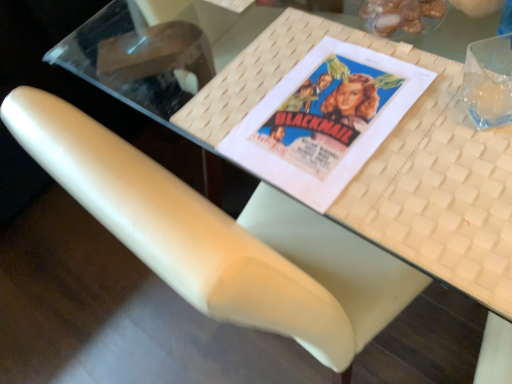
Question: Can you confirm if shiny brown nuts at upper right is smaller than white woven placemat at upper center?

Choices:
 (A) no
 (B) yes

Answer: (B)

Question: Does shiny brown nuts at upper right come in front of white woven placemat at upper center?

Choices:
 (A) yes
 (B) no

Answer: (B)

Question: Can you confirm if shiny brown nuts at upper right is bigger than white woven placemat at upper center?

Choices:
 (A) yes
 (B) no

Answer: (B)

Question: Can you confirm if shiny brown nuts at upper right is shorter than white woven placemat at upper center?

Choices:
 (A) yes
 (B) no

Answer: (B)

Question: Is shiny brown nuts at upper right facing away from white woven placemat at upper center?

Choices:
 (A) yes
 (B) no

Answer: (B)

Question: Considering the relative sizes of shiny brown nuts at upper right and white woven placemat at upper center in the image provided, is shiny brown nuts at upper right wider than white woven placemat at upper center?

Choices:
 (A) yes
 (B) no

Answer: (B)

Question: Is shiny brown nuts at upper right positioned far away from white leather chair at center?

Choices:
 (A) no
 (B) yes

Answer: (A)

Question: Considering the relative positions of shiny brown nuts at upper right and white leather chair at center in the image provided, is shiny brown nuts at upper right to the right of white leather chair at center from the viewer's perspective?

Choices:
 (A) no
 (B) yes

Answer: (B)

Question: Is shiny brown nuts at upper right smaller than white leather chair at center?

Choices:
 (A) yes
 (B) no

Answer: (A)

Question: From the image's perspective, is shiny brown nuts at upper right above white leather chair at center?

Choices:
 (A) yes
 (B) no

Answer: (A)

Question: Is white leather chair at center located within shiny brown nuts at upper right?

Choices:
 (A) no
 (B) yes

Answer: (A)

Question: Considering the relative sizes of shiny brown nuts at upper right and white leather chair at center in the image provided, is shiny brown nuts at upper right taller than white leather chair at center?

Choices:
 (A) yes
 (B) no

Answer: (A)

Question: Is white woven placemat at upper center a part of matte paper movie poster at center?

Choices:
 (A) yes
 (B) no

Answer: (A)